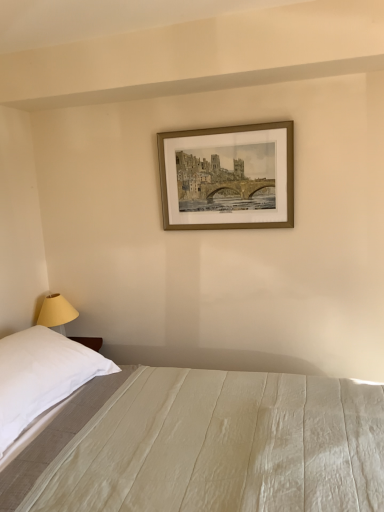
This screenshot has height=512, width=384. I want to click on white soft pillow at left, so click(41, 376).

In order to click on white cotton bed at lower center in this screenshot , I will do `click(204, 445)`.

Does gold metallic picture frame at upper center have a greater height compared to white soft pillow at left?

Yes, gold metallic picture frame at upper center is taller than white soft pillow at left.

Identify the location of picture frame behind the white soft pillow at left. (228, 177).

Which object is positioned more to the right, gold metallic picture frame at upper center or white soft pillow at left?

From the viewer's perspective, gold metallic picture frame at upper center appears more on the right side.

Between gold metallic picture frame at upper center and white cotton bed at lower center, which one is positioned behind?

gold metallic picture frame at upper center is behind.

Based on the photo, is white cotton bed at lower center at the back of gold metallic picture frame at upper center?

No, gold metallic picture frame at upper center's orientation is not away from white cotton bed at lower center.

From a real-world perspective, which is physically above, gold metallic picture frame at upper center or white cotton bed at lower center?

gold metallic picture frame at upper center.

Is white cotton bed at lower center positioned with its back to white soft pillow at left?

No, white cotton bed at lower center is not facing the opposite direction of white soft pillow at left.

From a real-world perspective, which is physically above, white cotton bed at lower center or white soft pillow at left?

white soft pillow at left is physically above.

Which object is further away from the camera, white cotton bed at lower center or white soft pillow at left?

white soft pillow at left is further away from the camera.

Looking at their sizes, would you say white cotton bed at lower center is wider or thinner than white soft pillow at left?

Considering their sizes, white cotton bed at lower center looks broader than white soft pillow at left.

Consider the image. Is white soft pillow at left directly adjacent to white cotton bed at lower center?

white soft pillow at left and white cotton bed at lower center are clearly separated.

From a real-world perspective, which object rests below the other?

From a 3D spatial view, white cotton bed at lower center is below.

How much distance is there between white soft pillow at left and white cotton bed at lower center?

The distance of white soft pillow at left from white cotton bed at lower center is 12.59 inches.

Could you tell me if white soft pillow at left is facing white cotton bed at lower center?

No, white soft pillow at left does not turn towards white cotton bed at lower center.

In order to click on pillow on the left of gold metallic picture frame at upper center in this screenshot , I will do (41, 376).

From the image's perspective, relative to gold metallic picture frame at upper center, is white soft pillow at left above or below?

Clearly, from the image's perspective, white soft pillow at left is below gold metallic picture frame at upper center.

Consider the image. Is the position of white soft pillow at left less distant than that of gold metallic picture frame at upper center?

Yes.

Which object is positioned more to the right, white soft pillow at left or gold metallic picture frame at upper center?

gold metallic picture frame at upper center is more to the right.

Considering the points (227, 444) and (163, 192), which point is in front, point (227, 444) or point (163, 192)?

Point (227, 444)

Considering the relative sizes of white cotton bed at lower center and gold metallic picture frame at upper center in the image provided, is white cotton bed at lower center wider than gold metallic picture frame at upper center?

Correct, the width of white cotton bed at lower center exceeds that of gold metallic picture frame at upper center.

Is white cotton bed at lower center looking in the opposite direction of gold metallic picture frame at upper center?

No, white cotton bed at lower center's orientation is not away from gold metallic picture frame at upper center.

Does white cotton bed at lower center have a greater height compared to gold metallic picture frame at upper center?

Indeed, white cotton bed at lower center has a greater height compared to gold metallic picture frame at upper center.

This screenshot has width=384, height=512. I want to click on pillow that is under the gold metallic picture frame at upper center (from a real-world perspective), so click(41, 376).

Identify the location of picture frame behind the white cotton bed at lower center. The height and width of the screenshot is (512, 384). (228, 177).

Which object lies further to the anchor point gold metallic picture frame at upper center, white cotton bed at lower center or white soft pillow at left?

white soft pillow at left.

Looking at the image, which one is located further to gold metallic picture frame at upper center, white soft pillow at left or white cotton bed at lower center?

Among the two, white soft pillow at left is located further to gold metallic picture frame at upper center.

When comparing their distances from white cotton bed at lower center, does white soft pillow at left or gold metallic picture frame at upper center seem further?

gold metallic picture frame at upper center lies further to white cotton bed at lower center than the other object.

Based on their spatial positions, is white cotton bed at lower center or gold metallic picture frame at upper center closer to white soft pillow at left?

white cotton bed at lower center lies closer to white soft pillow at left than the other object.

Looking at the image, which one is located further to white cotton bed at lower center, gold metallic picture frame at upper center or white soft pillow at left?

Based on the image, gold metallic picture frame at upper center appears to be further to white cotton bed at lower center.

Estimate the real-world distances between objects in this image. Which object is further from white soft pillow at left, gold metallic picture frame at upper center or white cotton bed at lower center?

gold metallic picture frame at upper center is positioned further to the anchor white soft pillow at left.

I want to click on pillow between gold metallic picture frame at upper center and white cotton bed at lower center in the vertical direction, so click(41, 376).